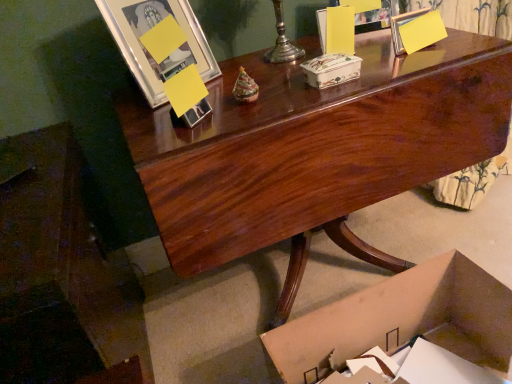
Question: Is cardboard box at lower right, placed as the 2th box when sorted from top to bottom, completely or partially outside of glossy wood desk at center?

Choices:
 (A) no
 (B) yes

Answer: (B)

Question: Can you confirm if cardboard box at lower right, the first box when ordered from bottom to top, is bigger than glossy wood desk at center?

Choices:
 (A) no
 (B) yes

Answer: (A)

Question: Could you tell me if cardboard box at lower right, the first box when ordered from bottom to top, is facing glossy wood desk at center?

Choices:
 (A) no
 (B) yes

Answer: (A)

Question: Can you confirm if cardboard box at lower right, the first box when ordered from bottom to top, is shorter than glossy wood desk at center?

Choices:
 (A) no
 (B) yes

Answer: (B)

Question: Can you confirm if cardboard box at lower right, the first box when ordered from bottom to top, is wider than glossy wood desk at center?

Choices:
 (A) yes
 (B) no

Answer: (A)

Question: From a real-world perspective, is metallic silver picture frame at upper left, marked as the second picture frame in a right-to-left arrangement, positioned above or below glossy wood desk at center?

Choices:
 (A) above
 (B) below

Answer: (A)

Question: Considering the positions of metallic silver picture frame at upper left, positioned as the first picture frame in front-to-back order, and glossy wood desk at center in the image, is metallic silver picture frame at upper left, positioned as the first picture frame in front-to-back order, taller or shorter than glossy wood desk at center?

Choices:
 (A) short
 (B) tall

Answer: (A)

Question: Considering the positions of point (142, 49) and point (214, 132), is point (142, 49) closer or farther from the camera than point (214, 132)?

Choices:
 (A) farther
 (B) closer

Answer: (A)

Question: In the image, is metallic silver picture frame at upper left, marked as the 2th picture frame in a back-to-front arrangement, on the left side or the right side of glossy wood desk at center?

Choices:
 (A) right
 (B) left

Answer: (B)

Question: From the image's perspective, relative to porcelain floral box at center, which ranks as the 1th box in top-to-bottom order, is matte silver picture frame at upper center, the 1th picture frame when ordered from back to front, above or below?

Choices:
 (A) below
 (B) above

Answer: (B)

Question: In terms of height, does matte silver picture frame at upper center, positioned as the 2th picture frame in left-to-right order, look taller or shorter compared to porcelain floral box at center, which ranks as the 1th box in top-to-bottom order?

Choices:
 (A) short
 (B) tall

Answer: (B)

Question: In the image, is matte silver picture frame at upper center, which is the first picture frame from right to left, positioned in front of or behind porcelain floral box at center, the second box when ordered from bottom to top?

Choices:
 (A) front
 (B) behind

Answer: (B)

Question: From a real-world perspective, relative to porcelain floral box at center, which ranks as the 1th box in top-to-bottom order, is matte silver picture frame at upper center, positioned as the 2th picture frame in left-to-right order, vertically above or below?

Choices:
 (A) above
 (B) below

Answer: (A)

Question: Visually, is glossy wood desk at center positioned to the left or to the right of porcelain floral box at center, the second box when ordered from bottom to top?

Choices:
 (A) left
 (B) right

Answer: (A)

Question: Considering the positions of point (147, 168) and point (355, 61), is point (147, 168) closer or farther from the camera than point (355, 61)?

Choices:
 (A) farther
 (B) closer

Answer: (B)